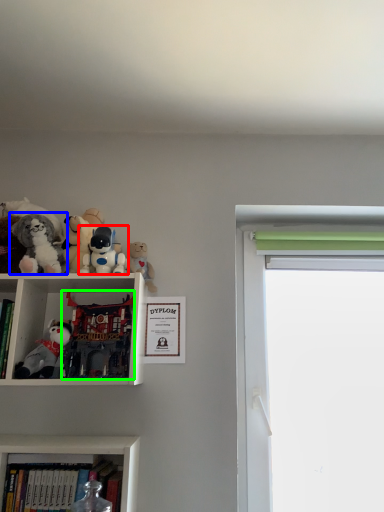
Question: Considering the real-world distances, which object is farthest from toy (highlighted by a red box)? toy (highlighted by a blue box) or toy (highlighted by a green box)?

Choices:
 (A) toy
 (B) toy

Answer: (B)